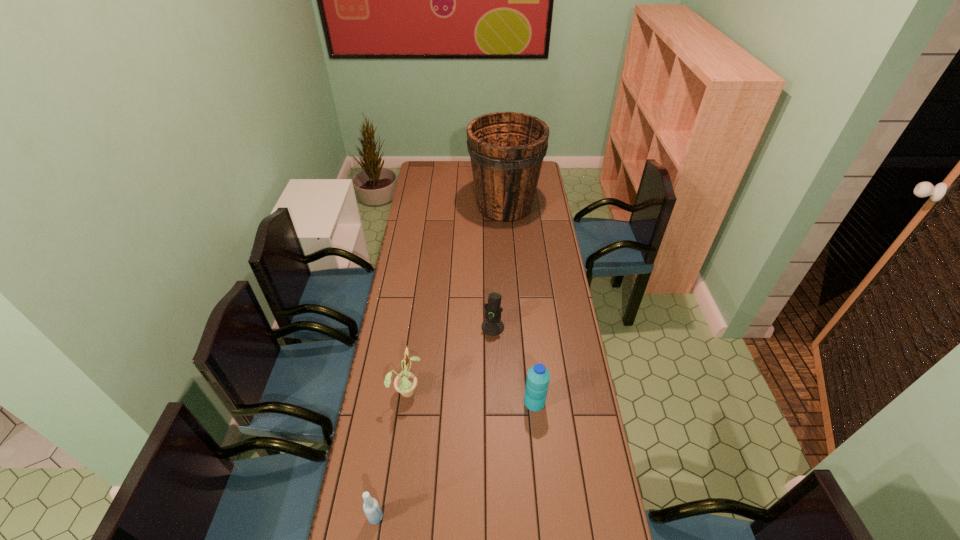
This screenshot has height=540, width=960. Identify the location of vacant space located on the right of the bottle. (479, 517).

Image resolution: width=960 pixels, height=540 pixels. In order to click on sunflower that is positioned at the left edge in this screenshot , I will do `click(405, 383)`.

The image size is (960, 540). Find the location of `bottle that is at the left edge`. bottle that is at the left edge is located at coordinates (371, 507).

Locate an element on the screen. This screenshot has height=540, width=960. bucket that is at the right edge is located at coordinates (507, 149).

Locate an element on the screen. This screenshot has height=540, width=960. water bottle that is at the right edge is located at coordinates (538, 377).

Locate an element on the screen. free point at the far edge is located at coordinates (460, 168).

The width and height of the screenshot is (960, 540). I want to click on free region at the left edge of the desktop, so click(x=404, y=319).

You are a GUI agent. You are given a task and a screenshot of the screen. Output one action in this format:
    pyautogui.click(x=<x>, y=<y>)
    Task: Click on the free space at the right edge
    The width and height of the screenshot is (960, 540).
    Given the screenshot: What is the action you would take?
    pyautogui.click(x=583, y=420)

Locate an element on the screen. The width and height of the screenshot is (960, 540). vacant space at the far left corner of the desktop is located at coordinates (418, 168).

This screenshot has width=960, height=540. I want to click on free area in between the bottle and the water bottle, so click(455, 459).